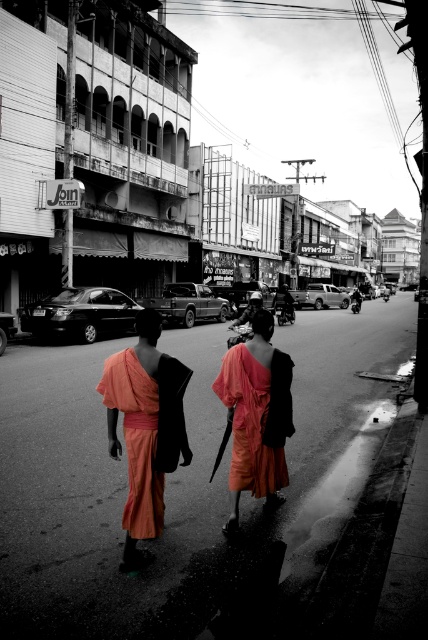
You are a photographer who wants to capture the two monks in the scene. Since the orange cotton robe at center and the matte orange robe at center are both in the center, which one appears narrower when viewed from your camera position?

The orange cotton robe at center is thinner than the matte orange robe at center, so it appears narrower when viewed from the camera position.

You are a photographer trying to capture both the orange cotton robe at center and the matte orange robe at center in a single frame. Given that your camera has a focal length of 50mm and a sensor size that allows for a maximum subject distance of 30 inches, will you be able to include both robes in the photo without moving closer?

The distance between the orange cotton robe at center and the matte orange robe at center is 34.10 inches. Since the maximum subject distance your camera can handle is 30 inches, you will not be able to capture both robes in a single frame without moving closer.